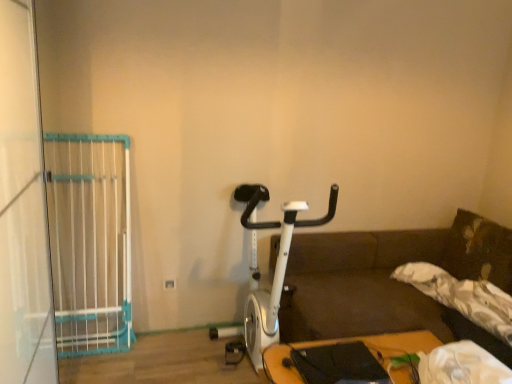
At what (x,y) coordinates should I click in order to perform the action: click on vacant area to the right of white plastic gate at left. Please return your answer as a coordinate pair (x, y). Image resolution: width=512 pixels, height=384 pixels. Looking at the image, I should click on (144, 359).